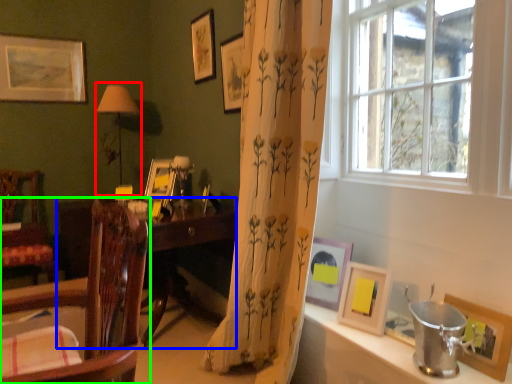
Question: Which object is the farthest from table lamp (highlighted by a red box)? Choose among these: desk (highlighted by a blue box) or chair (highlighted by a green box).

Choices:
 (A) desk
 (B) chair

Answer: (B)